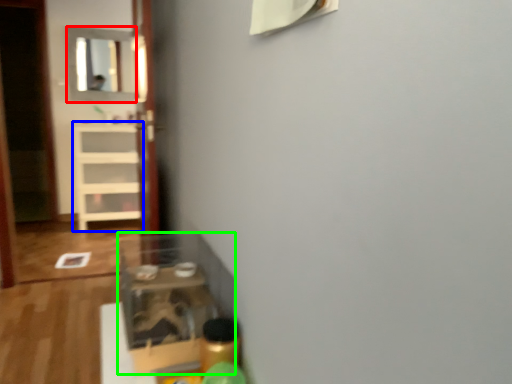
Question: Which object is the farthest from mirror (highlighted by a red box)? Choose among these: shelf (highlighted by a blue box) or shelf (highlighted by a green box).

Choices:
 (A) shelf
 (B) shelf

Answer: (B)